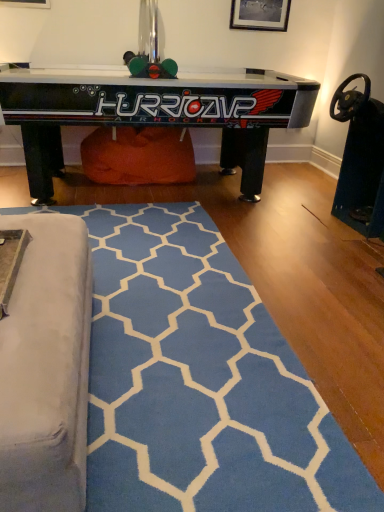
Find the location of a particular element. black glossy air hockey table at upper center is located at coordinates (150, 112).

Identify the location of blue soft rug at lower center. coord(199,380).

Find the location of a particular element. The width and height of the screenshot is (384, 512). wooden picture frame at upper center is located at coordinates (260, 15).

I want to click on black glossy air hockey table at upper center, so click(150, 112).

Is black glossy air hockey table at upper center far away from wooden picture frame at upper center?

That's right, there is a large distance between black glossy air hockey table at upper center and wooden picture frame at upper center.

Is black glossy air hockey table at upper center wider than wooden picture frame at upper center?

Correct, the width of black glossy air hockey table at upper center exceeds that of wooden picture frame at upper center.

How distant is black glossy air hockey table at upper center from wooden picture frame at upper center?

black glossy air hockey table at upper center is 3.66 feet away from wooden picture frame at upper center.

Considering the positions of objects black glossy air hockey table at upper center and wooden picture frame at upper center in the image provided, who is in front, black glossy air hockey table at upper center or wooden picture frame at upper center?

black glossy air hockey table at upper center is closer to the camera.

The height and width of the screenshot is (512, 384). What are the coordinates of `table located above the blue soft rug at lower center (from the image's perspective)` in the screenshot? It's located at [150, 112].

Can you confirm if black glossy air hockey table at upper center is positioned to the left of blue soft rug at lower center?

No.

Based on the photo, from a real-world perspective, between black glossy air hockey table at upper center and blue soft rug at lower center, who is vertically lower?

From a 3D spatial view, blue soft rug at lower center is below.

In the scene shown: Does black glossy air hockey table at upper center have a smaller size compared to blue soft rug at lower center?

No, black glossy air hockey table at upper center is not smaller than blue soft rug at lower center.

Is wooden picture frame at upper center looking in the opposite direction of blue soft rug at lower center?

wooden picture frame at upper center does not have its back to blue soft rug at lower center.

Is wooden picture frame at upper center at the right side of blue soft rug at lower center?

Yes.

Who is shorter, wooden picture frame at upper center or blue soft rug at lower center?

With less height is blue soft rug at lower center.

Relative to blue soft rug at lower center, is wooden picture frame at upper center in front or behind?

wooden picture frame at upper center is behind blue soft rug at lower center.

Can you confirm if blue soft rug at lower center is thinner than wooden picture frame at upper center?

Incorrect, the width of blue soft rug at lower center is not less than that of wooden picture frame at upper center.

Between blue soft rug at lower center and wooden picture frame at upper center, which one appears on the left side from the viewer's perspective?

blue soft rug at lower center.

From a real-world perspective, between blue soft rug at lower center and wooden picture frame at upper center, who is vertically higher?

From a 3D spatial view, wooden picture frame at upper center is above.

Between blue soft rug at lower center and black glossy air hockey table at upper center, which one appears on the left side from the viewer's perspective?

From the viewer's perspective, blue soft rug at lower center appears more on the left side.

Is point (313, 402) positioned behind point (252, 196)?

No, it is not.

Is blue soft rug at lower center next to black glossy air hockey table at upper center?

No, blue soft rug at lower center is not with black glossy air hockey table at upper center.

Consider the image. Is the depth of blue soft rug at lower center less than that of black glossy air hockey table at upper center?

Yes, blue soft rug at lower center is closer to the viewer.

From a real-world perspective, does wooden picture frame at upper center sit lower than black glossy air hockey table at upper center?

Incorrect, from a real-world perspective, wooden picture frame at upper center is higher than black glossy air hockey table at upper center.

How many degrees apart are the facing directions of wooden picture frame at upper center and black glossy air hockey table at upper center?

0.371 degrees separate the facing orientations of wooden picture frame at upper center and black glossy air hockey table at upper center.

Between wooden picture frame at upper center and black glossy air hockey table at upper center, which one has smaller size?

wooden picture frame at upper center is smaller.

Which of these two, wooden picture frame at upper center or black glossy air hockey table at upper center, is wider?

Wider between the two is black glossy air hockey table at upper center.

You are a GUI agent. You are given a task and a screenshot of the screen. Output one action in this format:
    pyautogui.click(x=<x>, y=<y>)
    Task: Click on the picture frame above the black glossy air hockey table at upper center (from the image's perspective)
    The width and height of the screenshot is (384, 512).
    Given the screenshot: What is the action you would take?
    pyautogui.click(x=260, y=15)

In order to click on table located above the blue soft rug at lower center (from a real-world perspective) in this screenshot , I will do `click(150, 112)`.

From the image, which object appears to be farther from wooden picture frame at upper center, black glossy air hockey table at upper center or blue soft rug at lower center?

blue soft rug at lower center lies further to wooden picture frame at upper center than the other object.

Based on their spatial positions, is black glossy air hockey table at upper center or wooden picture frame at upper center further from blue soft rug at lower center?

wooden picture frame at upper center lies further to blue soft rug at lower center than the other object.

When comparing their distances from blue soft rug at lower center, does wooden picture frame at upper center or black glossy air hockey table at upper center seem further?

Based on the image, wooden picture frame at upper center appears to be further to blue soft rug at lower center.

Consider the image. Which object lies further to the anchor point black glossy air hockey table at upper center, wooden picture frame at upper center or blue soft rug at lower center?

blue soft rug at lower center lies further to black glossy air hockey table at upper center than the other object.

From the image, which object appears to be farther from black glossy air hockey table at upper center, blue soft rug at lower center or wooden picture frame at upper center?

Among the two, blue soft rug at lower center is located further to black glossy air hockey table at upper center.

When comparing their distances from wooden picture frame at upper center, does blue soft rug at lower center or black glossy air hockey table at upper center seem further?

A: blue soft rug at lower center lies further to wooden picture frame at upper center than the other object.

Image resolution: width=384 pixels, height=512 pixels. I want to click on table located between blue soft rug at lower center and wooden picture frame at upper center in the depth direction, so (x=150, y=112).